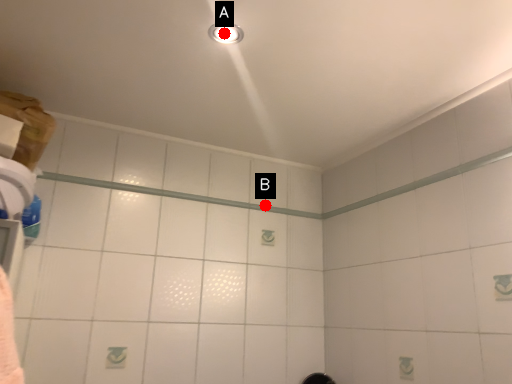
Question: Two points are circled on the image, labeled by A and B beside each circle. Which of the following is the farthest from the observer?

Choices:
 (A) A is further
 (B) B is further

Answer: (B)